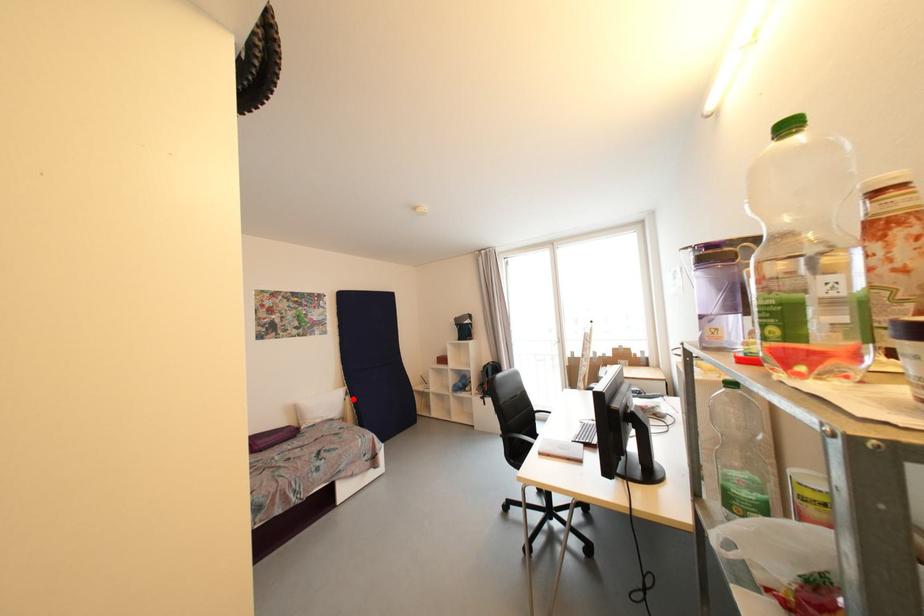
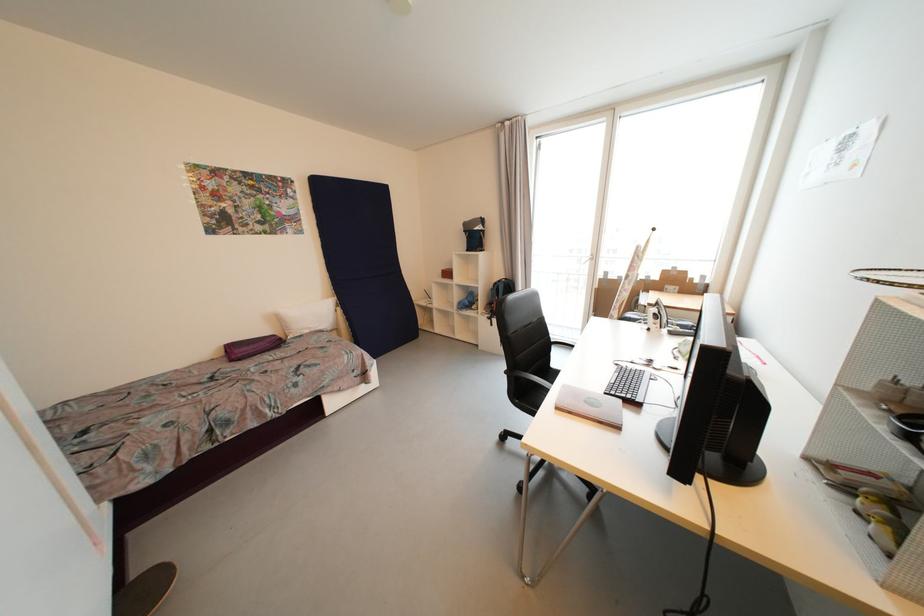
In the second image, find the point that corresponds to the highlighted location in the first image.

(344, 310)